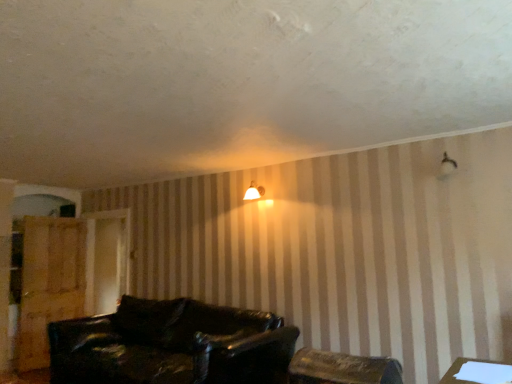
Question: Can you confirm if matte white lampshade at upper center is shorter than white paper at lower right?

Choices:
 (A) yes
 (B) no

Answer: (B)

Question: Is matte white lampshade at upper center closer to the viewer compared to white paper at lower right?

Choices:
 (A) yes
 (B) no

Answer: (B)

Question: Could white paper at lower right be considered to be inside matte white lampshade at upper center?

Choices:
 (A) yes
 (B) no

Answer: (B)

Question: From a real-world perspective, is matte white lampshade at upper center on top of white paper at lower right?

Choices:
 (A) no
 (B) yes

Answer: (B)

Question: Is matte white lampshade at upper center completely or partially outside of white paper at lower right?

Choices:
 (A) no
 (B) yes

Answer: (B)

Question: Does matte white lampshade at upper center come behind white paper at lower right?

Choices:
 (A) yes
 (B) no

Answer: (A)

Question: Could wooden dresser at left be considered to be inside white paper at lower right?

Choices:
 (A) yes
 (B) no

Answer: (B)

Question: Can you confirm if white paper at lower right is thinner than wooden dresser at left?

Choices:
 (A) no
 (B) yes

Answer: (A)

Question: Is white paper at lower right shorter than wooden dresser at left?

Choices:
 (A) yes
 (B) no

Answer: (A)

Question: Is the depth of white paper at lower right less than that of wooden dresser at left?

Choices:
 (A) yes
 (B) no

Answer: (A)

Question: Can you confirm if white paper at lower right is smaller than wooden dresser at left?

Choices:
 (A) no
 (B) yes

Answer: (B)

Question: Is white paper at lower right behind wooden dresser at left?

Choices:
 (A) no
 (B) yes

Answer: (A)

Question: Is wooden chair at lower center turned away from leather couch at lower center?

Choices:
 (A) no
 (B) yes

Answer: (A)